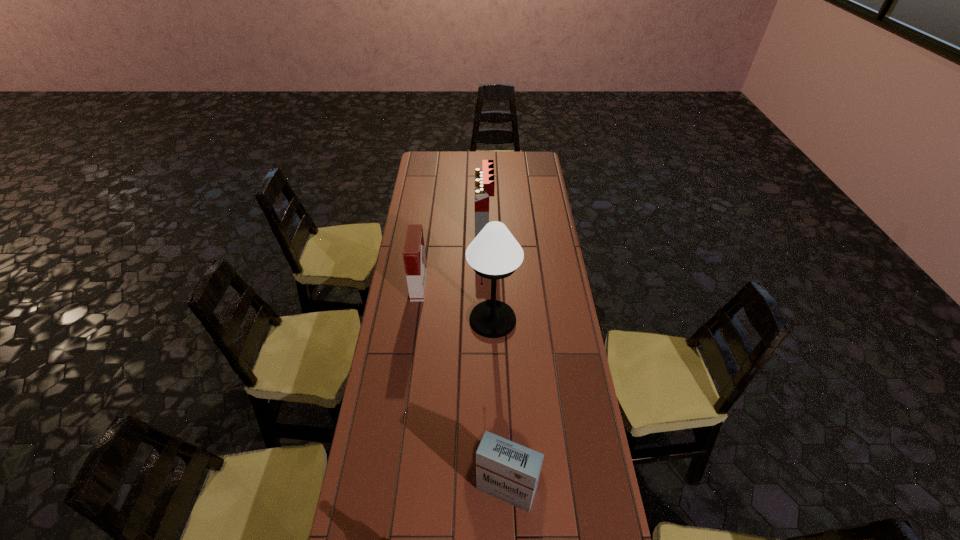
The image size is (960, 540). What are the coordinates of `vacant space that satisfies the following two spatial constraints: 1. on the front-facing side of the nearest cigarette case; 2. on the left side of the leftmost cigarette case` in the screenshot? It's located at (392, 490).